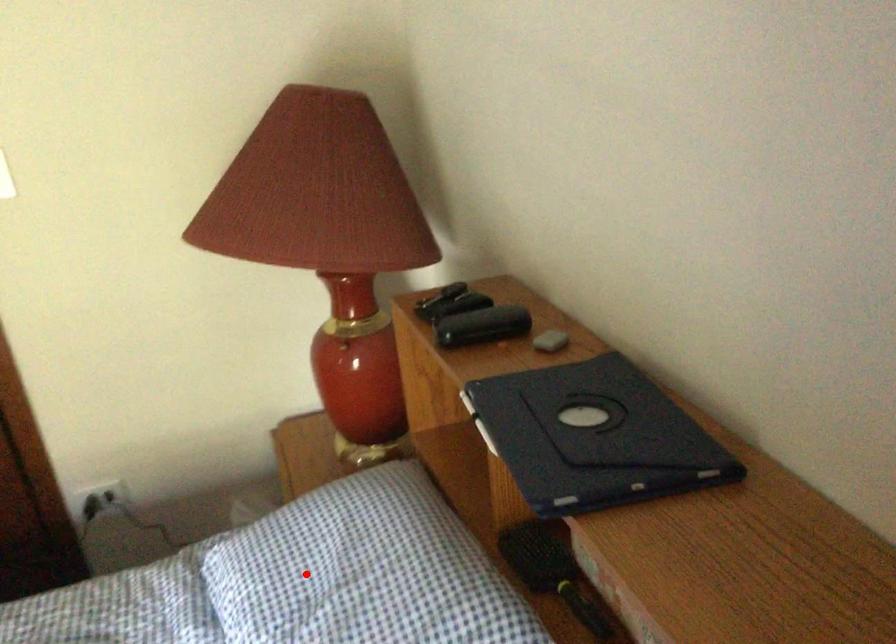
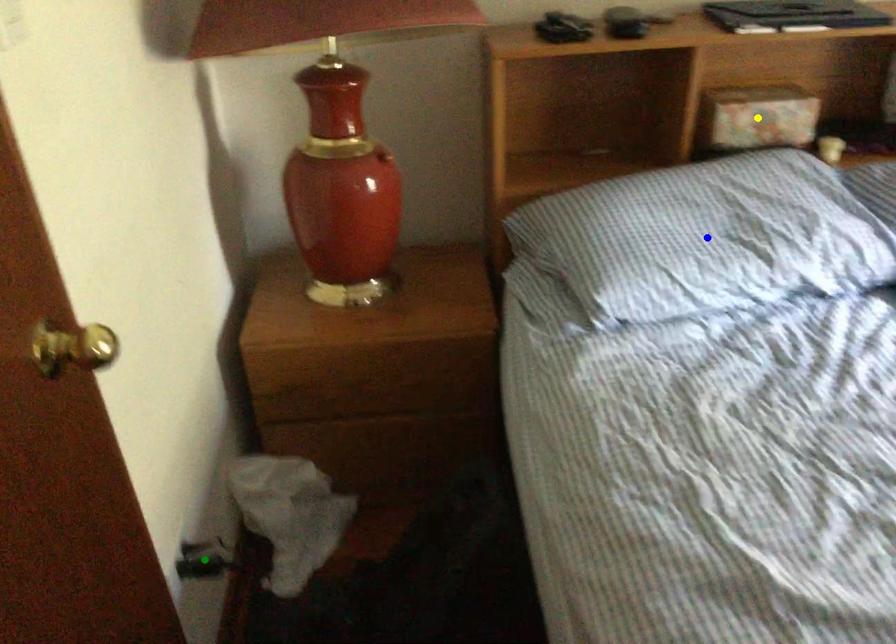
Question: I am providing you with two images of the same scene from different viewpoints. A red point is marked on the first image. You are given multiple points on the second image. Which mark in image 2 goes with the point in image 1?

Choices:
 (A) yellow point
 (B) blue point
 (C) green point

Answer: (B)